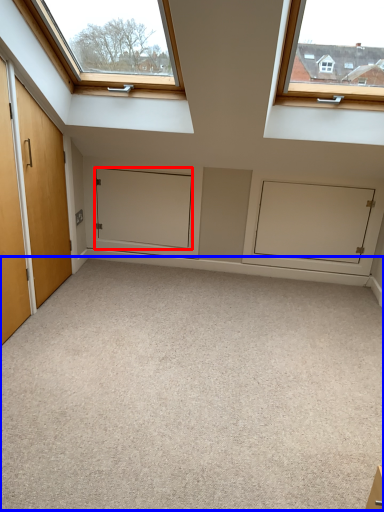
Question: Which object is further to the camera taking this photo, door (highlighted by a red box) or plain (highlighted by a blue box)?

Choices:
 (A) door
 (B) plain

Answer: (A)